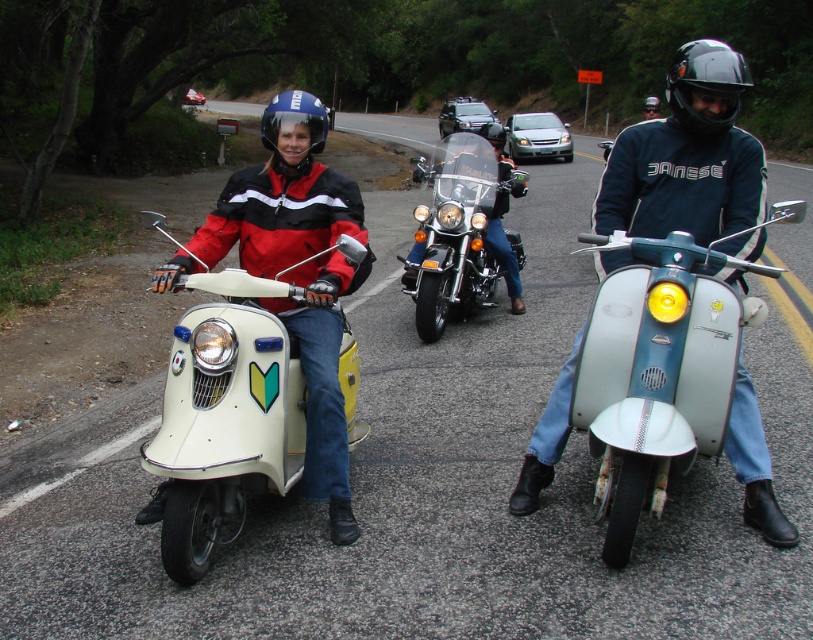
Question: Which point is closer to the camera?

Choices:
 (A) (350, 410)
 (B) (285, 104)
 (C) (485, 204)
 (D) (494, 132)

Answer: (B)

Question: Among these objects, which one is nearest to the camera?

Choices:
 (A) black matte helmet at upper center
 (B) metallic blue scooter at center
 (C) matte black helmet at center
 (D) shiny chrome cruiser at center

Answer: (B)

Question: Can you confirm if shiny chrome cruiser at center is bigger than matte black helmet at center?

Choices:
 (A) no
 (B) yes

Answer: (A)

Question: Which object appears closest to the camera in this image?

Choices:
 (A) matte black helmet at center
 (B) matte blue helmet at center

Answer: (B)

Question: Can you confirm if matte blue helmet at center is thinner than black matte goggles at upper center?

Choices:
 (A) yes
 (B) no

Answer: (A)

Question: Is matte blue helmet at center to the left of black matte goggles at upper center from the viewer's perspective?

Choices:
 (A) yes
 (B) no

Answer: (A)